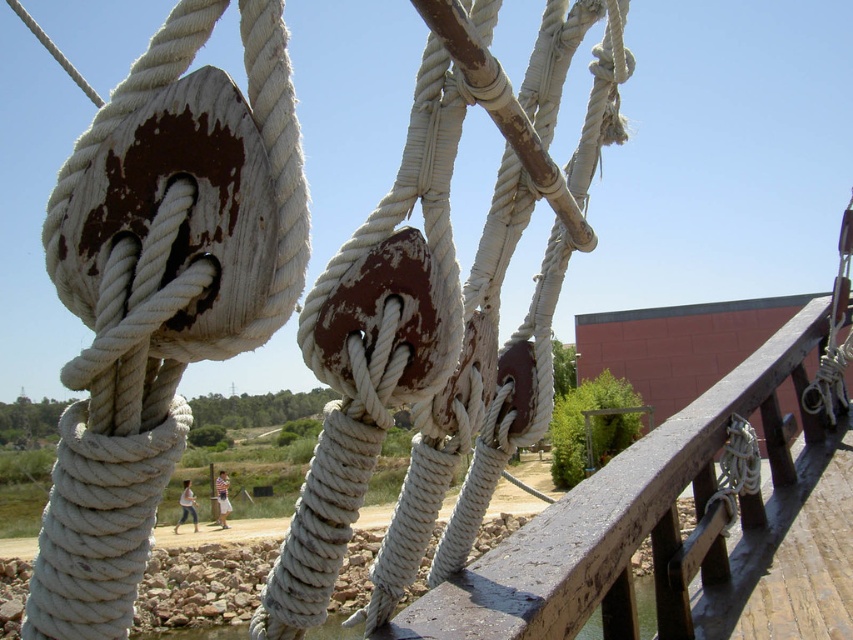
You are standing on the rope bridge and want to reach a point that is exactly 5 feet away from where you are currently standing. Is the point at coordinates point (486, 579) within that 5 feet range?

The point (486, 579) is 5.71 feet from camera, so it is slightly beyond the 5 feet range.

You are standing on the rope bridge and want to look down at the clear water at lower left. Which direction should you look relative to the rustic wood rail at center?

You should look downward from the rustic wood rail at center to see the clear water at lower left since the rustic wood rail at center is located above the clear water at lower left.

You are standing on the rope bridge and looking down. You see the rustic wood rail at center and the clear water at lower left. Which object is closer to you?

The rustic wood rail at center is closer to you because it is in front of the clear water at lower left.